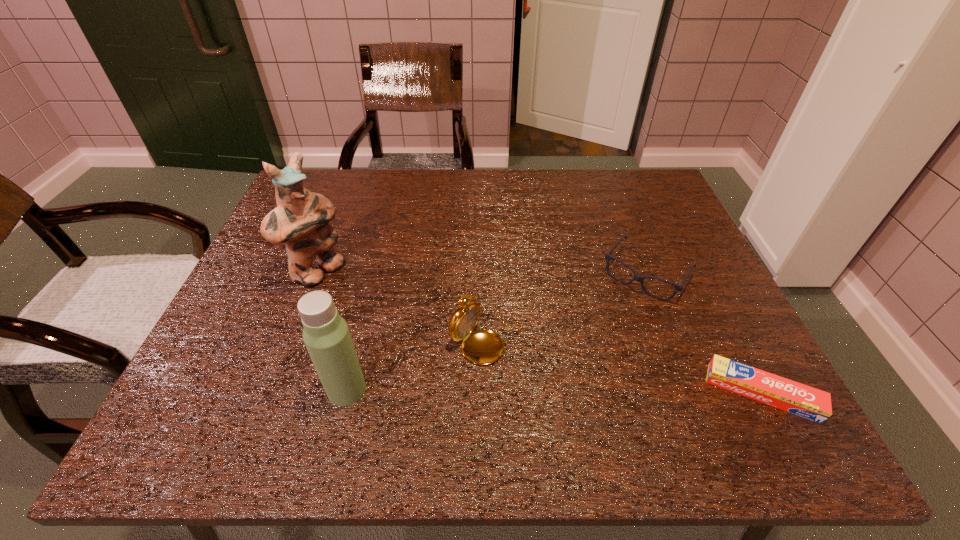
Find the location of `free space on the desktop that is between the second tallest object and the shortest object and is positioned on the front-facing side of the figurine`. free space on the desktop that is between the second tallest object and the shortest object and is positioned on the front-facing side of the figurine is located at coordinates 498,391.

Where is `free space on the desktop that is between the fourth shortest object and the toothpaste and is positioned on the face of the third tallest object`? free space on the desktop that is between the fourth shortest object and the toothpaste and is positioned on the face of the third tallest object is located at coordinates point(575,392).

Locate an element on the screen. The image size is (960, 540). vacant space on the desktop that is between the fourth shortest object and the shortest object and is positioned on the front-facing side of the fourth tallest object is located at coordinates (563, 392).